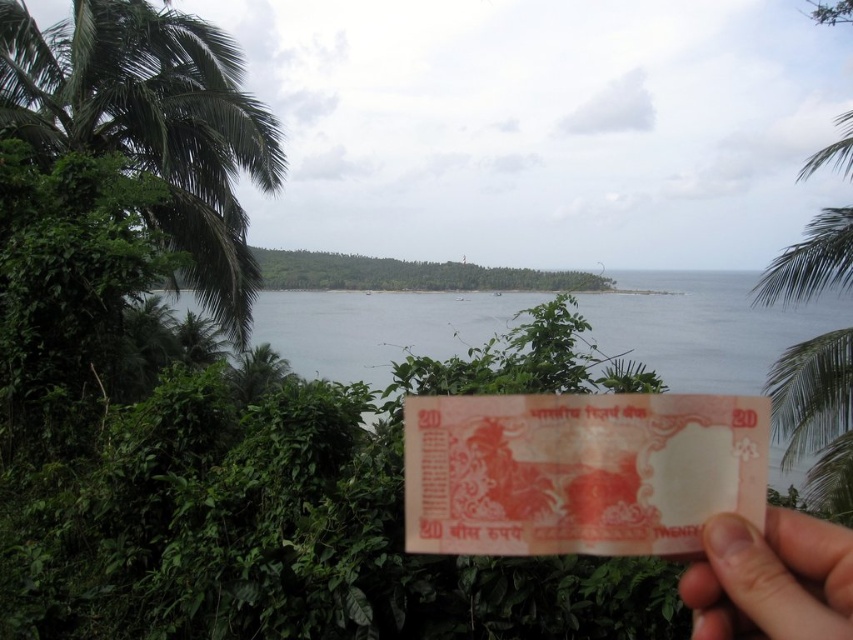
Question: Estimate the real-world distances between objects in this image. Which object is farther from the pink matte paper at lower right?

Choices:
 (A) transparent water at center
 (B) pink paper currency at center
 (C) green leafy palm tree at left

Answer: (C)

Question: Does transparent water at center have a greater width compared to pink matte paper at lower right?

Choices:
 (A) no
 (B) yes

Answer: (B)

Question: Observing the image, what is the correct spatial positioning of pink paper currency at center in reference to green leafy palm tree at right?

Choices:
 (A) right
 (B) left

Answer: (B)

Question: Which point is closer to the camera taking this photo?

Choices:
 (A) (119, 3)
 (B) (428, 468)
 (C) (498, 298)
 (D) (724, 612)

Answer: (D)

Question: Is pink paper currency at center thinner than transparent water at center?

Choices:
 (A) no
 (B) yes

Answer: (B)

Question: Based on their relative distances, which object is nearer to the green leafy palm tree at left?

Choices:
 (A) pink matte paper at lower right
 (B) transparent water at center

Answer: (B)